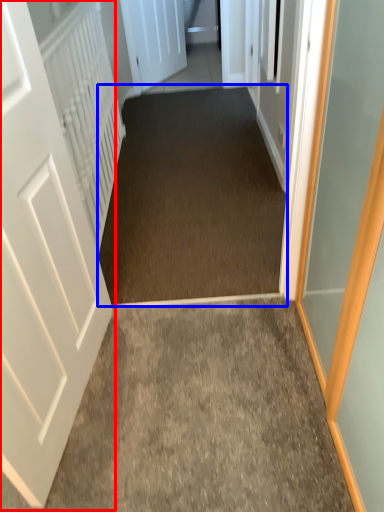
Question: Which object is closer to the camera taking this photo, door (highlighted by a red box) or corridor (highlighted by a blue box)?

Choices:
 (A) door
 (B) corridor

Answer: (A)